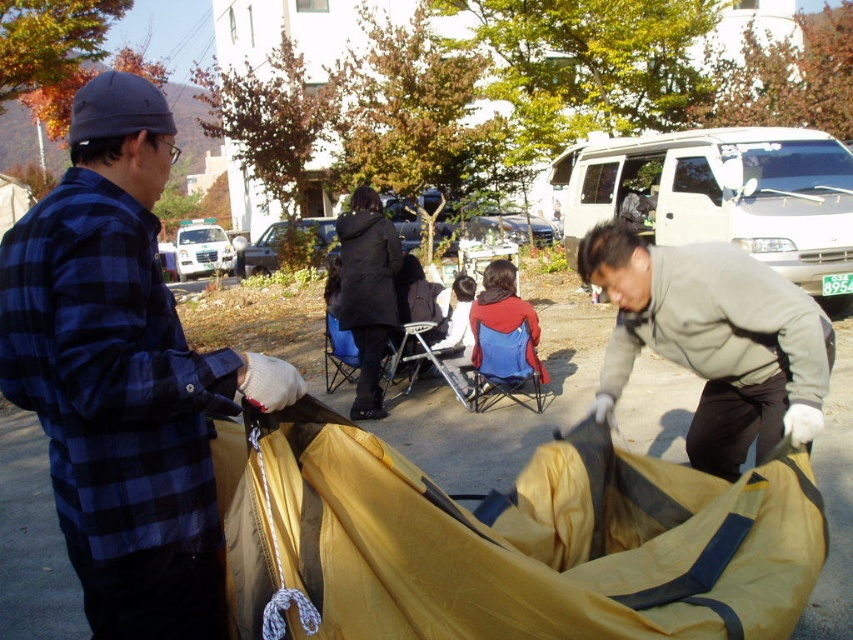
You are a photographer standing in front of the scene. You need to take a photo that includes both the blue fabric baby carriage at center and the black matte coat at center. Which object should you focus on first to ensure both are in sharp focus?

The blue fabric baby carriage at center is closer to the viewer than the black matte coat at center. To ensure both are in sharp focus, you should focus on the blue fabric baby carriage at center first since it is closer, and the depth of field will extend to the farther object.

You are a photographer trying to capture a clear photo of the black matte coat at center without the gray fleece jacket at lower right blocking it. What should you do?

Move your position to the left so that the gray fleece jacket at lower right is no longer in front of the black matte coat at center.

You are a photographer trying to capture both the gray fleece jacket at lower right and the black matte coat at center in a single shot. Which object should you focus on first to ensure both are in frame?

The gray fleece jacket at lower right is shorter than the black matte coat at center, so you should focus on the taller black matte coat at center first to ensure both are in frame.